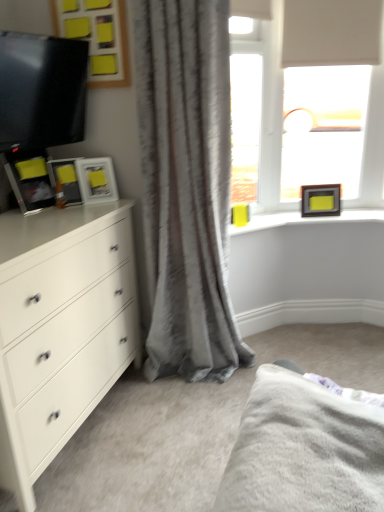
At what (x,y) coordinates should I click in order to perform the action: click on free location to the right of matte black picture frame at left, the 3th picture frame in the back-to-front sequence. Please return your answer as a coordinate pair (x, y). Looking at the image, I should click on (106, 204).